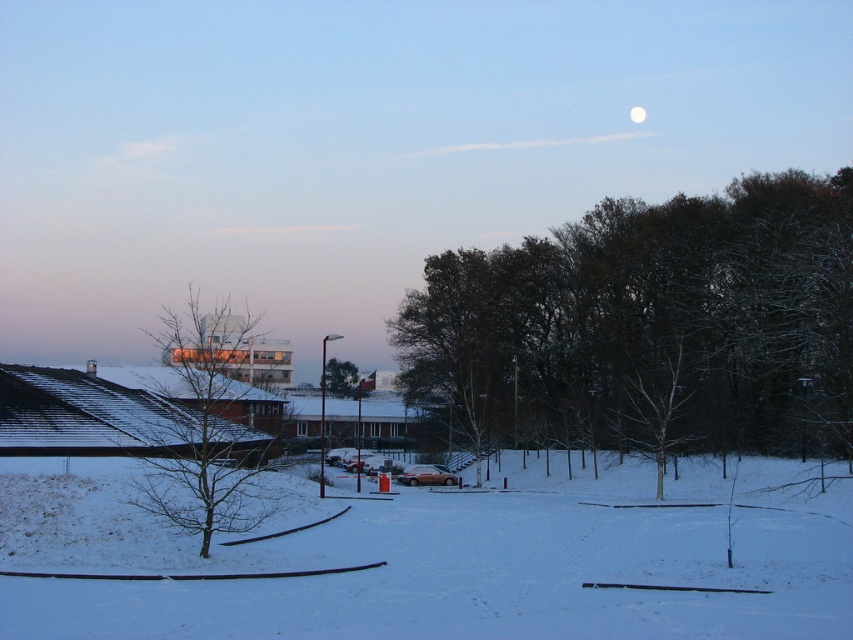
Is dark brown textured tree at center to the right of green leafy tree at center from the viewer's perspective?

Correct, you'll find dark brown textured tree at center to the right of green leafy tree at center.

Can you confirm if dark brown textured tree at center is positioned above green leafy tree at center?

Indeed, dark brown textured tree at center is positioned over green leafy tree at center.

Who is more distant from viewer, (697, 394) or (334, 372)?

The point (334, 372) is more distant.

Find the location of a particular element. The width and height of the screenshot is (853, 640). dark brown textured tree at center is located at coordinates (647, 326).

Is point (486, 280) more distant than point (242, 509)?

Yes.

Locate an element on the screen. dark brown textured tree at center is located at coordinates (647, 326).

Who is more forward, (840, 433) or (630, 116)?

Point (840, 433) is in front.

Can you confirm if dark brown textured tree at center is positioned above white glossy moon at upper center?

No.

The width and height of the screenshot is (853, 640). What do you see at coordinates (647, 326) in the screenshot?
I see `dark brown textured tree at center` at bounding box center [647, 326].

Locate an element on the screen. dark brown textured tree at center is located at coordinates (647, 326).